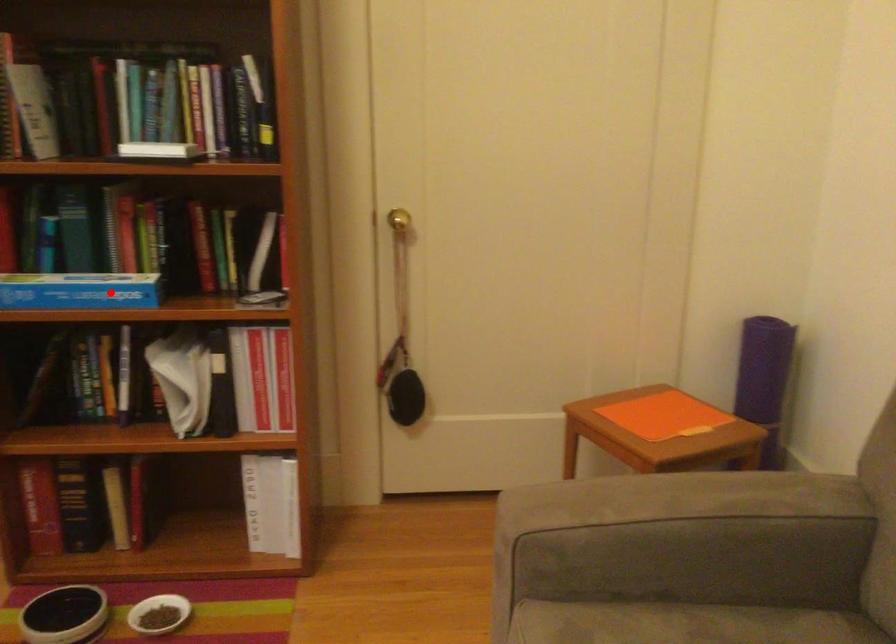
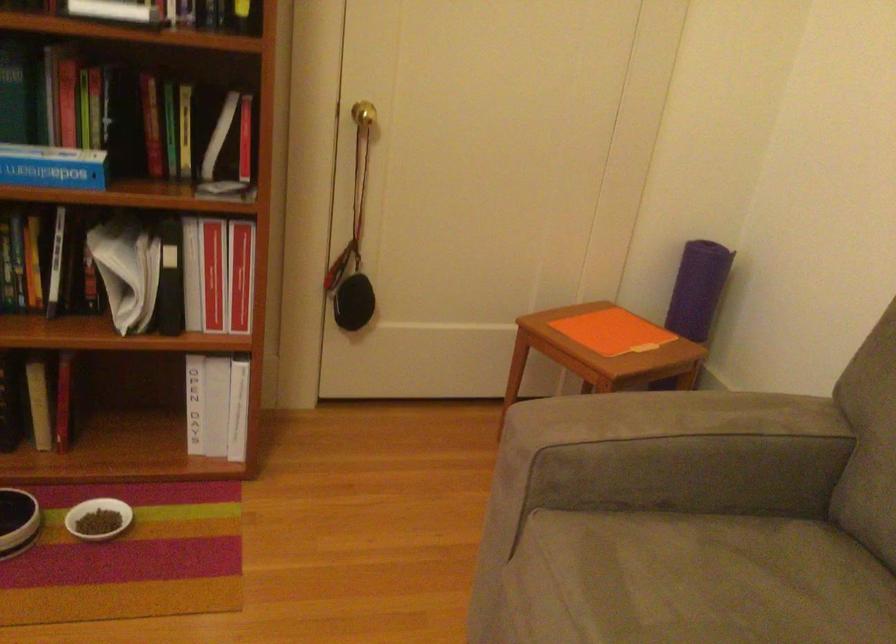
Question: I am providing you with two images of the same scene from different viewpoints. Image1 has a red point marked. In image2, the corresponding 3D location appears at what relative position? Reply with the corresponding letter.

Choices:
 (A) Closer
 (B) Farther

Answer: (A)